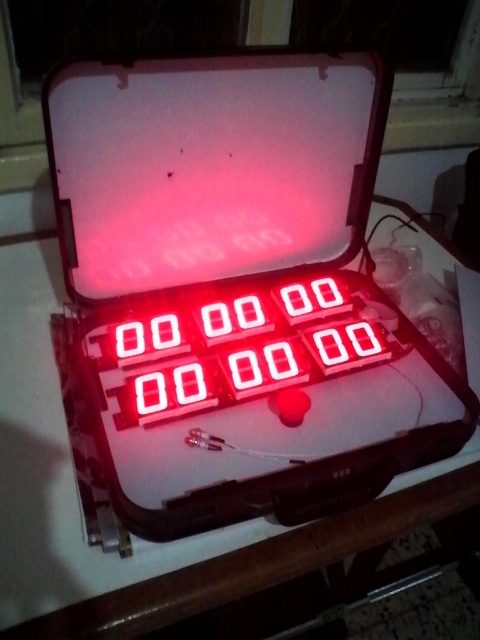
Who is more distant from viewer, (336,339) or (158,365)?

The point (336,339) is more distant.

Can you confirm if white plastic case at center is shorter than red led display at center?

In fact, white plastic case at center may be taller than red led display at center.

Locate an element on the screen. This screenshot has width=480, height=640. white plastic case at center is located at coordinates (237, 291).